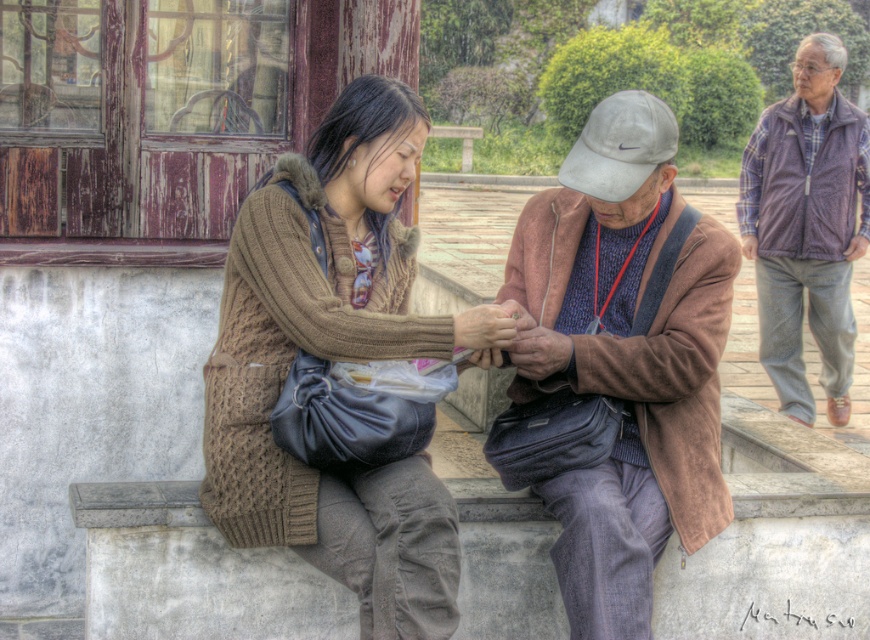
Is brown knitted sweater at center positioned before purple fleece vest at upper right?

Yes.

Which is behind, point (346, 195) or point (805, 269)?

Positioned behind is point (805, 269).

What are the coordinates of `brown knitted sweater at center` in the screenshot? It's located at (336, 358).

Who is taller, brown suede jacket at center or white suede baseball cap at center?

Standing taller between the two is white suede baseball cap at center.

Locate an element on the screen. The width and height of the screenshot is (870, 640). brown suede jacket at center is located at coordinates (617, 364).

Is point (648, 288) behind point (671, 131)?

Yes, it is.

Find the location of `brown suede jacket at center`. brown suede jacket at center is located at coordinates (617, 364).

What do you see at coordinates (617, 364) in the screenshot? I see `brown suede jacket at center` at bounding box center [617, 364].

Does brown suede jacket at center have a greater width compared to purple fleece vest at upper right?

Yes, brown suede jacket at center is wider than purple fleece vest at upper right.

Who is more distant from viewer, (681, 416) or (778, 260)?

The point (778, 260) is more distant.

Locate an element on the screen. brown suede jacket at center is located at coordinates (617, 364).